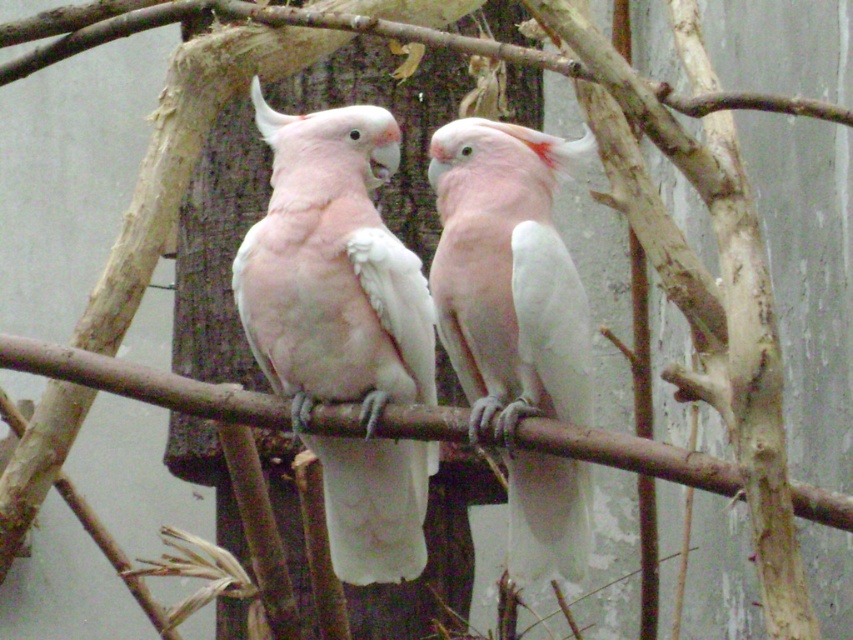
You are a zookeeper who needs to place a divider between the pink feathered parrot at center and the white feathered parrot at center to separate them. The divider you have is 15 centimeters wide. Will the divider fit between them without overlapping either bird?

The divider will fit between the pink feathered parrot at center and the white feathered parrot at center because the distance between them is 17.18 centimeters, which is wider than the 15 centimeter divider. This allows enough space for the divider to be placed between them without overlapping either bird.

You are a zookeeper observing two parrots in an enclosure. You notice a pink feathered parrot at center and a white feathered parrot at center. Which parrot is positioned higher in the enclosure?

The pink feathered parrot at center is located above the white feathered parrot at center, so it is positioned higher in the enclosure.

You are a zookeeper observing two cockatoos in their enclosure. You notice a specific point in the image marked at coordinates (343, 324). Which cockatoo is positioned exactly at this point?

The pink feathered parrot at center is positioned exactly at point (343, 324).